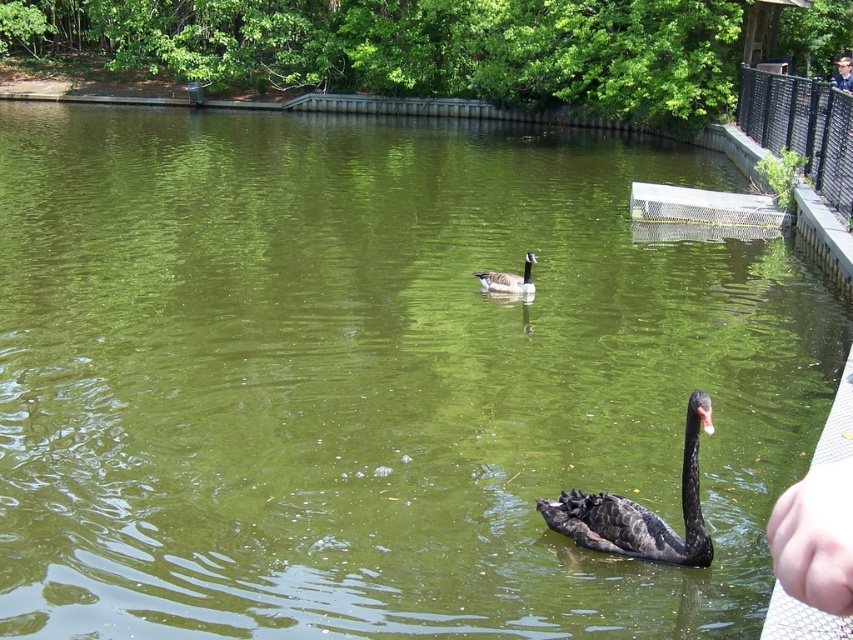
You are holding a camera and want to take a photo of the black glossy swan at lower right. If you are currently 5.12 meters away from it, and your camera has a minimum focusing distance of 3 meters, can you take a clear photo without moving closer?

Yes, the black glossy swan at lower right is 5.12 meters away from the camera, which is beyond the minimum focusing distance of 3 meters. Therefore, you can take a clear photo without moving closer.

Based on the coordinates provided in the Objects Description, where is the black glossy swan at lower right located in the image?

The black glossy swan at lower right is located at point coordinates of (640, 509).